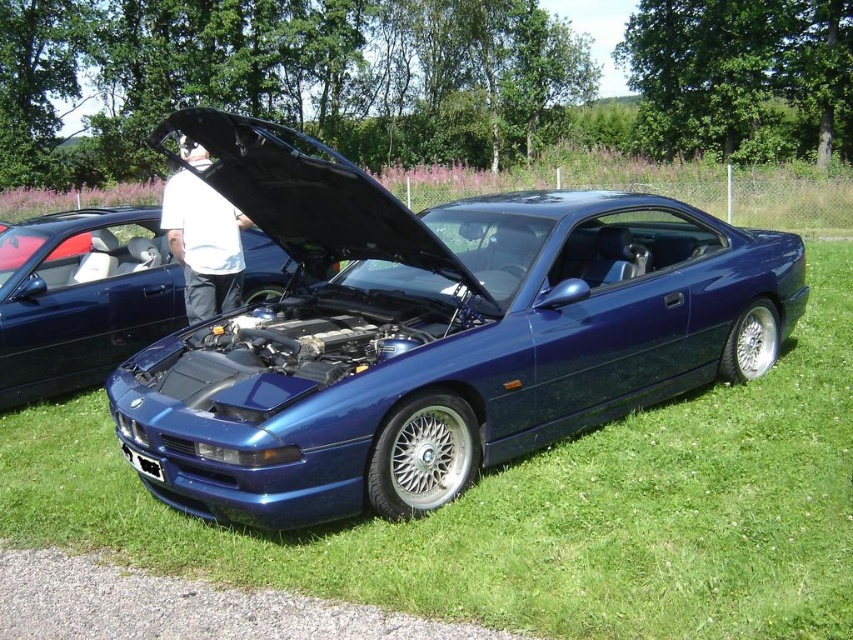
Which is more to the left, metallic blue car at center or white matte shirt at center?

white matte shirt at center is more to the left.

Looking at this image, can you confirm if metallic blue car at center is wider than white matte shirt at center?

Indeed, metallic blue car at center has a greater width compared to white matte shirt at center.

Is point (236, 467) in front of point (207, 280)?

Yes, point (236, 467) is closer to viewer.

I want to click on metallic blue car at center, so click(x=432, y=333).

Is green grass at center to the right of metallic blue engine at center from the viewer's perspective?

Correct, you'll find green grass at center to the right of metallic blue engine at center.

Is green grass at center thinner than metallic blue engine at center?

Yes, green grass at center is thinner than metallic blue engine at center.

Does point (808, 355) lie in front of point (136, 230)?

Yes, it is in front of point (136, 230).

Identify the location of green grass at center. (538, 509).

Does point (62, 452) lie in front of point (173, 237)?

Yes, it is in front of point (173, 237).

Describe the element at coordinates (538, 509) in the screenshot. I see `green grass at center` at that location.

Find the location of a particular element. green grass at center is located at coordinates [538, 509].